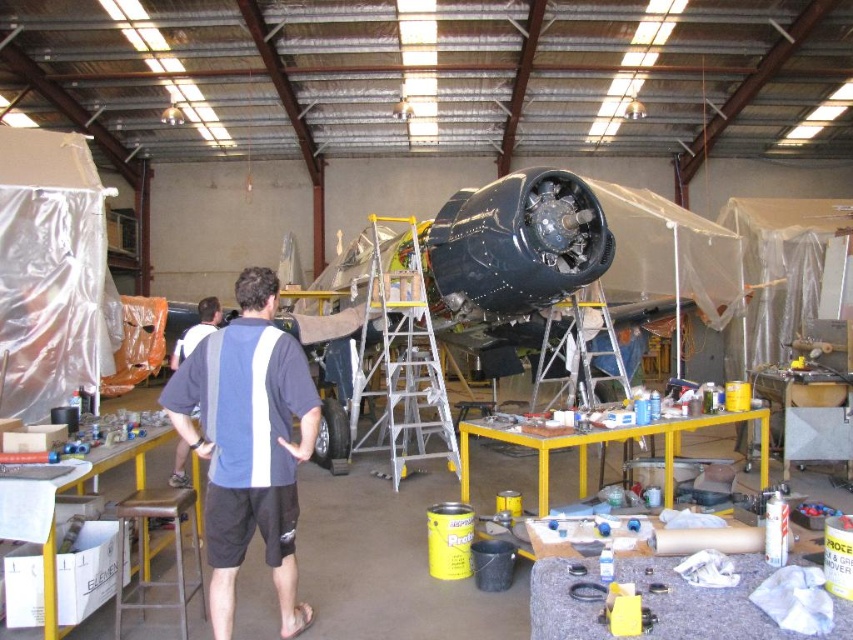
In the scene shown: You are a drone operator flying a drone inside the hangar. You need to navigate between two points marked as point (409,349) and point (206,305). Which point is closer to the camera you are holding?

Point (206,305) is closer to the camera because point (409,349) is further away from the camera than point (206,305).